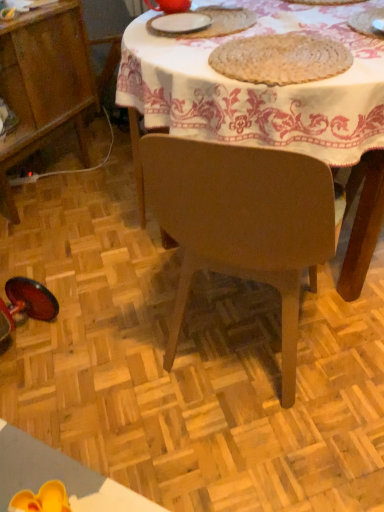
Question: Considering the relative positions of white matte plate at upper center, marked as the 2th tableware in a right-to-left arrangement, and white woven placemat at upper right, which ranks as the 1th tableware in right-to-left order, in the image provided, is white matte plate at upper center, marked as the 2th tableware in a right-to-left arrangement, in front of white woven placemat at upper right, which ranks as the 1th tableware in right-to-left order,?

Choices:
 (A) no
 (B) yes

Answer: (A)

Question: Is white matte plate at upper center, marked as the 2th tableware in a right-to-left arrangement, wider than white woven placemat at upper right, which ranks as the 1th tableware in right-to-left order?

Choices:
 (A) yes
 (B) no

Answer: (B)

Question: From a real-world perspective, is white matte plate at upper center, marked as the 2th tableware in a right-to-left arrangement, positioned under white woven placemat at upper right, which ranks as the 1th tableware in right-to-left order, based on gravity?

Choices:
 (A) yes
 (B) no

Answer: (A)

Question: Is white matte plate at upper center, marked as the 2th tableware in a right-to-left arrangement, smaller than white woven placemat at upper right, which ranks as the 1th tableware in right-to-left order?

Choices:
 (A) yes
 (B) no

Answer: (A)

Question: Does white matte plate at upper center, marked as the 2th tableware in a right-to-left arrangement, touch white woven placemat at upper right, which ranks as the 1th tableware in right-to-left order?

Choices:
 (A) yes
 (B) no

Answer: (B)

Question: Relative to wooden cabinet at lower left, is wooden table at center in front or behind?

Choices:
 (A) front
 (B) behind

Answer: (A)

Question: From a real-world perspective, is wooden table at center positioned above or below wooden cabinet at lower left?

Choices:
 (A) below
 (B) above

Answer: (A)

Question: Considering the positions of point (339, 131) and point (16, 92), is point (339, 131) closer or farther from the camera than point (16, 92)?

Choices:
 (A) closer
 (B) farther

Answer: (A)

Question: In terms of size, does wooden table at center appear bigger or smaller than wooden cabinet at lower left?

Choices:
 (A) big
 (B) small

Answer: (A)

Question: Is point (375, 10) positioned closer to the camera than point (64, 34)?

Choices:
 (A) farther
 (B) closer

Answer: (B)

Question: Is white woven placemat at upper right, which appears as the 3th tableware when viewed from the left, spatially inside wooden cabinet at lower left, or outside of it?

Choices:
 (A) inside
 (B) outside

Answer: (B)

Question: Based on their positions, is white woven placemat at upper right, which ranks as the 1th tableware in right-to-left order, located to the left or right of wooden cabinet at lower left?

Choices:
 (A) right
 (B) left

Answer: (A)

Question: From a real-world perspective, is white woven placemat at upper right, which appears as the 3th tableware when viewed from the left, above or below wooden cabinet at lower left?

Choices:
 (A) below
 (B) above

Answer: (B)

Question: From the image's perspective, relative to matte red teapot at upper center, the 3th tableware in the right-to-left sequence, is wooden cabinet at lower left above or below?

Choices:
 (A) below
 (B) above

Answer: (A)

Question: Do you think wooden cabinet at lower left is within matte red teapot at upper center, the 3th tableware in the right-to-left sequence, or outside of it?

Choices:
 (A) inside
 (B) outside

Answer: (B)